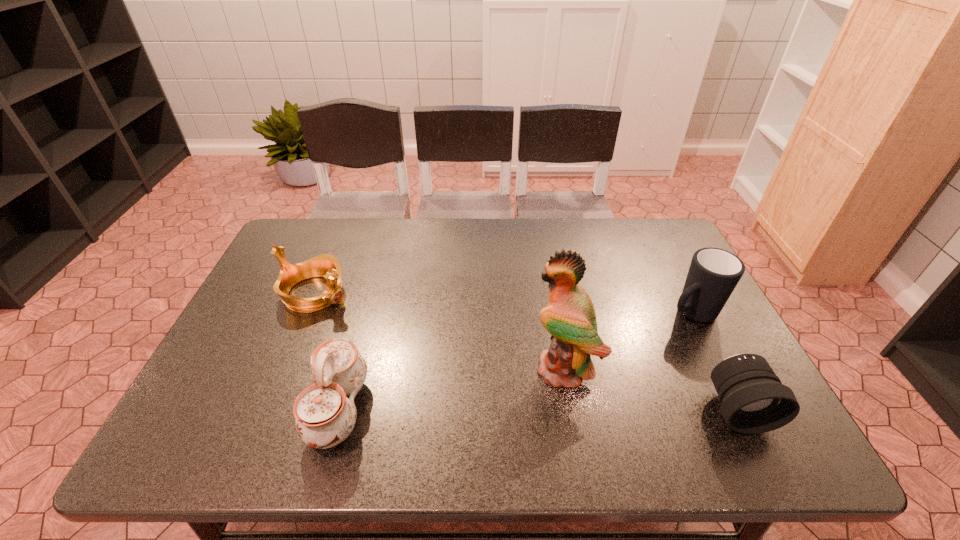
You are a GUI agent. You are given a task and a screenshot of the screen. Output one action in this format:
    pyautogui.click(x=<x>, y=<y>)
    Task: Click on the chinaware
    The height and width of the screenshot is (540, 960).
    Given the screenshot: What is the action you would take?
    pyautogui.click(x=325, y=417)

You are a GUI agent. You are given a task and a screenshot of the screen. Output one action in this format:
    pyautogui.click(x=<x>, y=<y>)
    Task: Click on the telephoto lens
    This screenshot has height=540, width=960.
    Given the screenshot: What is the action you would take?
    pyautogui.click(x=754, y=400)

This screenshot has height=540, width=960. Identify the location of tiara. (326, 265).

The image size is (960, 540). In order to click on mug in this screenshot , I will do `click(714, 273)`.

The image size is (960, 540). Find the location of `parrot`. parrot is located at coordinates (569, 317).

Identify the location of the tallest object. This screenshot has width=960, height=540. (569, 317).

Where is `vacant region located by the handle of the chinaware`? vacant region located by the handle of the chinaware is located at coordinates (191, 409).

You are a GUI agent. You are given a task and a screenshot of the screen. Output one action in this format:
    pyautogui.click(x=<x>, y=<y>)
    Task: Click on the vacant space located by the handle of the chinaware
    
    Given the screenshot: What is the action you would take?
    pyautogui.click(x=186, y=409)

You are a GUI agent. You are given a task and a screenshot of the screen. Output one action in this format:
    pyautogui.click(x=<x>, y=<y>)
    Task: Click on the vacant space located by the handle of the chinaware
    The height and width of the screenshot is (540, 960).
    Given the screenshot: What is the action you would take?
    pyautogui.click(x=281, y=409)

The width and height of the screenshot is (960, 540). Find the location of `vacant space located at the front emblem of the tiara`. vacant space located at the front emblem of the tiara is located at coordinates (461, 360).